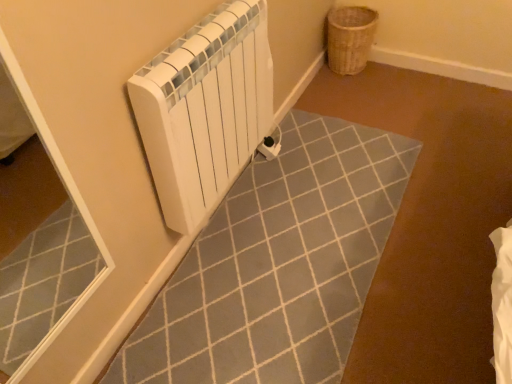
Question: Is white matte radiator at upper left bigger or smaller than woven brown basket at upper right?

Choices:
 (A) small
 (B) big

Answer: (B)

Question: Considering the positions of white matte radiator at upper left and woven brown basket at upper right in the image, is white matte radiator at upper left wider or thinner than woven brown basket at upper right?

Choices:
 (A) thin
 (B) wide

Answer: (A)

Question: Is point (218, 170) positioned closer to the camera than point (362, 49)?

Choices:
 (A) closer
 (B) farther

Answer: (A)

Question: Based on their positions, is woven brown basket at upper right located to the left or right of white matte radiator at upper left?

Choices:
 (A) right
 (B) left

Answer: (A)

Question: Based on their sizes in the image, would you say woven brown basket at upper right is bigger or smaller than white matte radiator at upper left?

Choices:
 (A) small
 (B) big

Answer: (A)

Question: Is point (335, 16) closer or farther from the camera than point (219, 135)?

Choices:
 (A) farther
 (B) closer

Answer: (A)

Question: In terms of width, does woven brown basket at upper right look wider or thinner when compared to white matte radiator at upper left?

Choices:
 (A) wide
 (B) thin

Answer: (A)